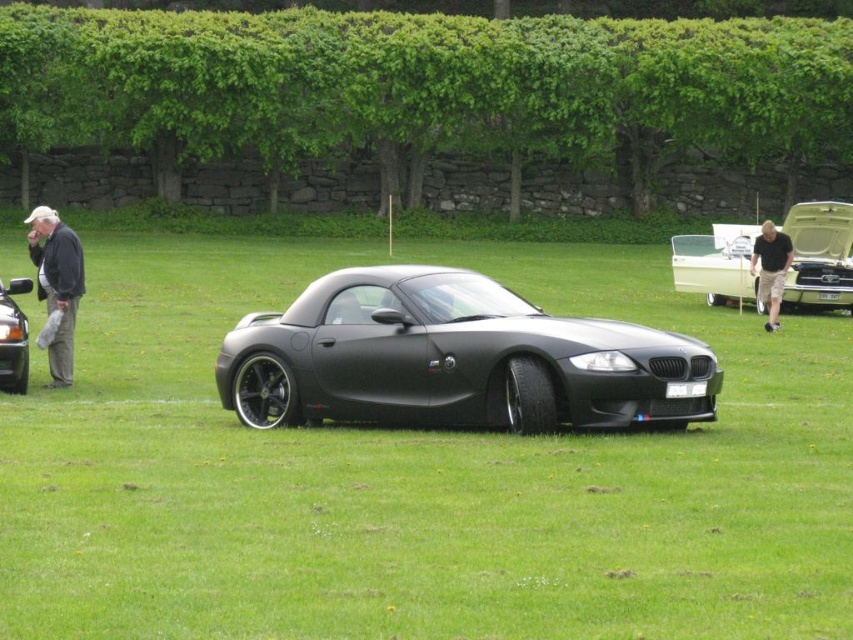
Question: Which point is farther to the camera?

Choices:
 (A) matte black car at left
 (B) gray fabric pants at left
 (C) black cotton shorts at center

Answer: (C)

Question: Does matte black sports car at center appear on the left side of matte black car at left?

Choices:
 (A) no
 (B) yes

Answer: (A)

Question: Based on their relative distances, which object is nearer to the matte black car at left?

Choices:
 (A) matte black sports car at center
 (B) matte black car at center

Answer: (A)

Question: Is matte black car at left above black cotton shorts at center?

Choices:
 (A) no
 (B) yes

Answer: (A)

Question: Is the position of matte black sports car at center more distant than that of black cotton shorts at center?

Choices:
 (A) yes
 (B) no

Answer: (B)

Question: Considering the real-world distances, which object is closest to the gray fabric pants at left?

Choices:
 (A) matte black car at center
 (B) green grass at center
 (C) black cotton shorts at center
 (D) matte black sports car at center

Answer: (D)